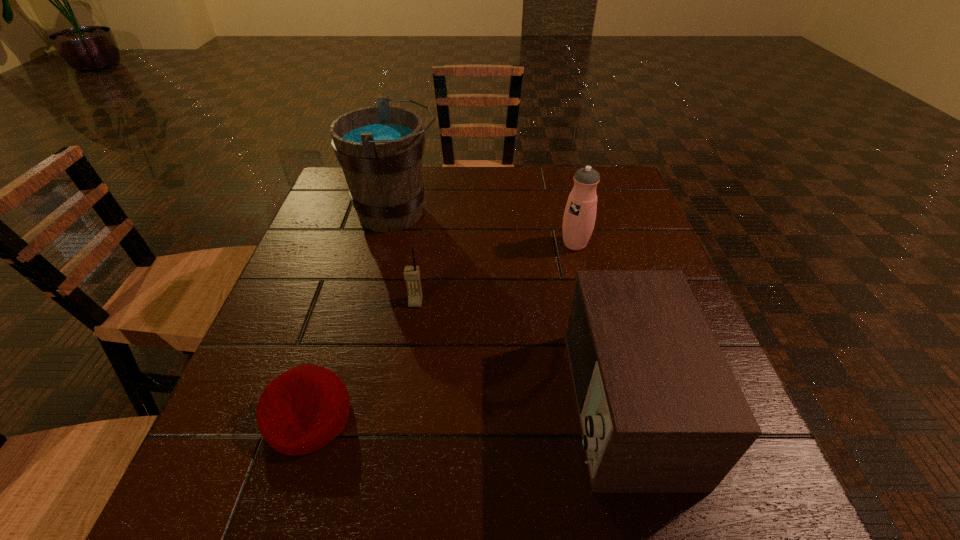
Locate an element on the screen. vacant space at the far edge of the desktop is located at coordinates (532, 208).

Find the location of a particular element. vacant region at the near edge is located at coordinates (450, 500).

Find the location of a particular element. free space at the left edge of the desktop is located at coordinates (261, 356).

In the image, there is a desktop. Where is `free region at the near left corner`? This screenshot has width=960, height=540. free region at the near left corner is located at coordinates (263, 461).

You are a GUI agent. You are given a task and a screenshot of the screen. Output one action in this format:
    pyautogui.click(x=<x>, y=<y>)
    Task: Click on the vacant space at the far right corner of the desktop
    The height and width of the screenshot is (540, 960).
    Given the screenshot: What is the action you would take?
    pyautogui.click(x=612, y=184)

The height and width of the screenshot is (540, 960). I want to click on vacant space at the near right corner, so click(x=680, y=507).

This screenshot has width=960, height=540. In order to click on free spot between the thermos bottle and the fourth tallest object in this screenshot , I will do tap(495, 273).

Find the location of a particular element. This screenshot has width=960, height=540. free space that is in between the thermos bottle and the beanbag is located at coordinates (442, 330).

Image resolution: width=960 pixels, height=540 pixels. Find the location of `free spot between the thermos bottle and the shortest object`. free spot between the thermos bottle and the shortest object is located at coordinates (442, 330).

At what (x,y) coordinates should I click in order to perform the action: click on free area in between the tallest object and the shortest object. Please return your answer as a coordinate pair (x, y). Image resolution: width=960 pixels, height=540 pixels. Looking at the image, I should click on (352, 314).